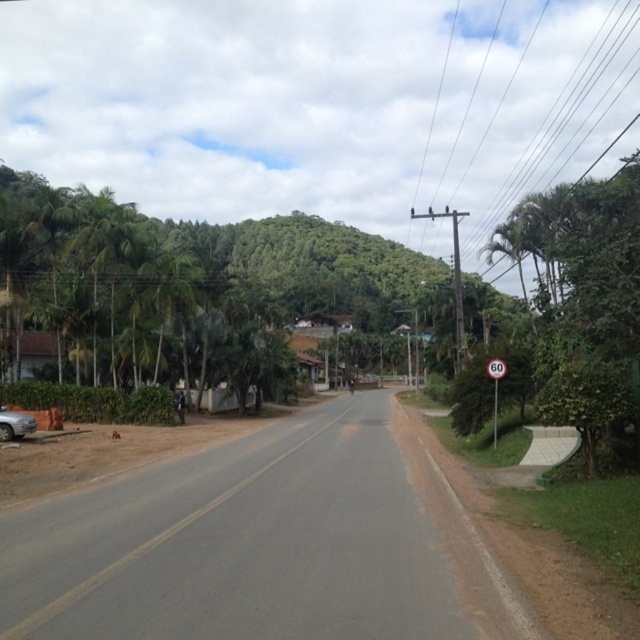
Looking at this image, does green leafy trees at left have a lesser height compared to silver metallic car at lower left?

In fact, green leafy trees at left may be taller than silver metallic car at lower left.

Measure the distance between point (0,248) and camera.

A distance of 31.65 meters exists between point (0,248) and camera.

At what (x,y) coordinates should I click in order to perform the action: click on green leafy trees at left. Please return your answer as a coordinate pair (x, y). Looking at the image, I should click on (129, 300).

Is green leafy trees at left further to camera compared to white plastic speed limit sign at right?

That is True.

Between point (116, 378) and point (500, 358), which one is positioned behind?

The point (116, 378) is behind.

Between point (148, 227) and point (486, 368), which one is positioned behind?

Positioned behind is point (148, 227).

Find the location of a particular element. green leafy trees at left is located at coordinates (129, 300).

Does silver metallic car at lower left come behind white plastic speed limit sign at right?

Yes, it is.

Is silver metallic car at lower left thinner than white plastic speed limit sign at right?

No.

Which is behind, point (17, 416) or point (496, 436)?

The point (17, 416) is behind.

The image size is (640, 640). In order to click on silver metallic car at lower left in this screenshot , I will do `click(13, 422)`.